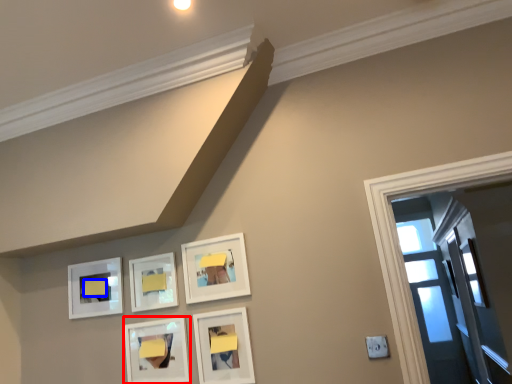
Question: Among these objects, which one is farthest to the camera, picture frame (highlighted by a red box) or furniture (highlighted by a blue box)?

Choices:
 (A) picture frame
 (B) furniture

Answer: (B)